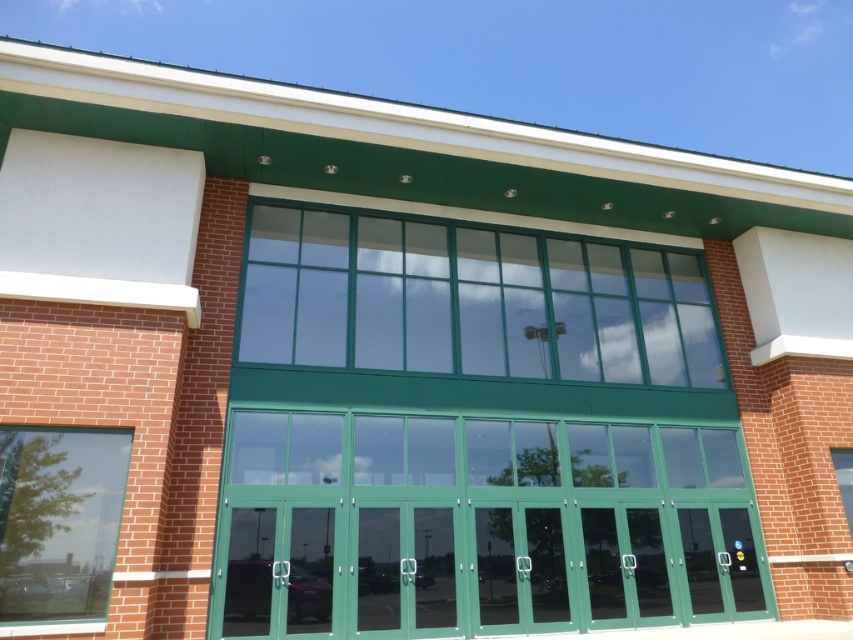
Between green glass window at center and clear glass window at lower left, which one is positioned higher?

Positioned higher is green glass window at center.

Does green glass window at center have a greater height compared to clear glass window at lower left?

No, green glass window at center is not taller than clear glass window at lower left.

Who is more distant from viewer, (601,308) or (96,563)?

The point (601,308) is behind.

At what (x,y) coordinates should I click in order to perform the action: click on green glass window at center. Please return your answer as a coordinate pair (x, y). The image size is (853, 640). Looking at the image, I should click on (471, 301).